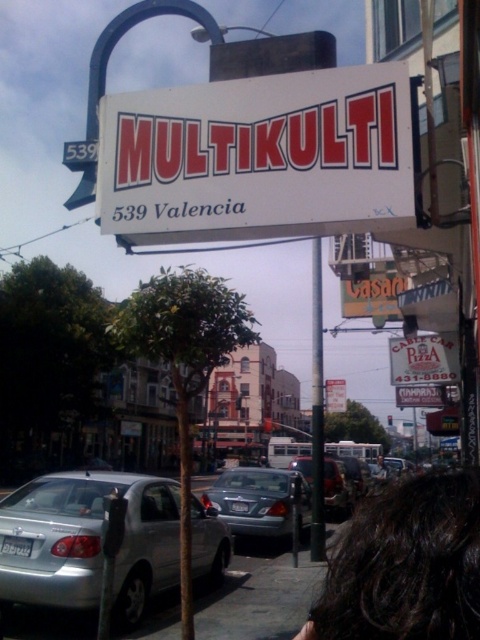
Question: Which point appears farthest from the camera in this image?

Choices:
 (A) (443, 541)
 (B) (237, 520)
 (C) (334, 472)
 (D) (57, 602)

Answer: (C)

Question: Can you confirm if white paper sign at center is positioned below matte silver sedan at center?

Choices:
 (A) yes
 (B) no

Answer: (B)

Question: Can you confirm if dark hair at lower right is thinner than brown leather jacket at lower right?

Choices:
 (A) yes
 (B) no

Answer: (A)

Question: Among these objects, which one is farthest from the camera?

Choices:
 (A) metallic silver sedan at center
 (B) brown leather jacket at lower right

Answer: (B)

Question: Is white plastic sign at center positioned before dark hair at lower right?

Choices:
 (A) yes
 (B) no

Answer: (B)

Question: Which object is farther from the camera taking this photo?

Choices:
 (A) white paper sign at center
 (B) silver metallic car at lower left
 (C) white plastic sign at center

Answer: (A)